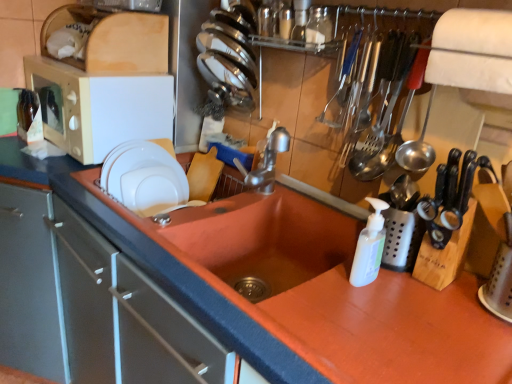
Question: Does transparent glass jar at upper center, the second bottle in the bottom-to-top sequence, have a lesser height compared to shiny stainless steel plates at upper center, which is the second tableware from left to right?

Choices:
 (A) no
 (B) yes

Answer: (B)

Question: Is transparent glass jar at upper center, the 1th bottle from the front, next to shiny stainless steel plates at upper center, positioned as the first tableware in right-to-left order?

Choices:
 (A) yes
 (B) no

Answer: (B)

Question: Considering the relative sizes of transparent glass jar at upper center, positioned as the second bottle in left-to-right order, and shiny stainless steel plates at upper center, positioned as the first tableware in right-to-left order, in the image provided, is transparent glass jar at upper center, positioned as the second bottle in left-to-right order, thinner than shiny stainless steel plates at upper center, positioned as the first tableware in right-to-left order,?

Choices:
 (A) no
 (B) yes

Answer: (B)

Question: From the image's perspective, is transparent glass jar at upper center, positioned as the second bottle in left-to-right order, below shiny stainless steel plates at upper center, acting as the 1th tableware starting from the top?

Choices:
 (A) yes
 (B) no

Answer: (A)

Question: Are transparent glass jar at upper center, positioned as the first bottle in right-to-left order, and shiny stainless steel plates at upper center, acting as the second tableware starting from the bottom, far apart?

Choices:
 (A) no
 (B) yes

Answer: (A)

Question: Considering the relative sizes of transparent glass jar at upper center, the second bottle in the bottom-to-top sequence, and shiny stainless steel plates at upper center, which is the second tableware from left to right, in the image provided, is transparent glass jar at upper center, the second bottle in the bottom-to-top sequence, wider than shiny stainless steel plates at upper center, which is the second tableware from left to right,?

Choices:
 (A) yes
 (B) no

Answer: (B)

Question: From a real-world perspective, is matte white drawer at left under shiny stainless steel plates at upper center, acting as the 1th tableware starting from the top?

Choices:
 (A) yes
 (B) no

Answer: (A)

Question: Is matte white drawer at left to the left of shiny stainless steel plates at upper center, acting as the second tableware starting from the bottom, from the viewer's perspective?

Choices:
 (A) yes
 (B) no

Answer: (A)

Question: Is matte white drawer at left wider than shiny stainless steel plates at upper center, positioned as the first tableware in right-to-left order?

Choices:
 (A) yes
 (B) no

Answer: (A)

Question: From the image's perspective, is matte white drawer at left located above shiny stainless steel plates at upper center, positioned as the first tableware in right-to-left order?

Choices:
 (A) yes
 (B) no

Answer: (B)

Question: Is matte white drawer at left shorter than shiny stainless steel plates at upper center, acting as the second tableware starting from the bottom?

Choices:
 (A) yes
 (B) no

Answer: (B)

Question: From the image's perspective, is matte white drawer at left beneath shiny stainless steel plates at upper center, acting as the 1th tableware starting from the top?

Choices:
 (A) no
 (B) yes

Answer: (B)

Question: From a real-world perspective, is metallic silverware at upper right located higher than shiny stainless steel plates at upper center, positioned as the first tableware in right-to-left order?

Choices:
 (A) yes
 (B) no

Answer: (B)